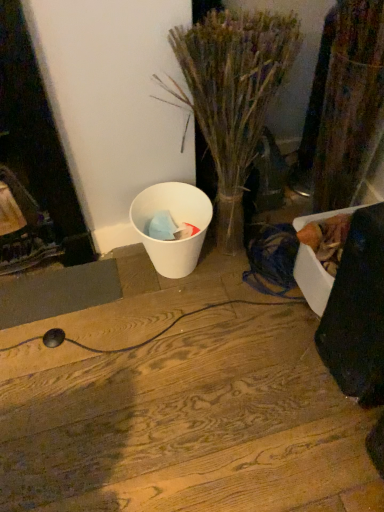
Locate an element on the screen. free spot to the left of white matte trash can at lower left is located at coordinates (97, 282).